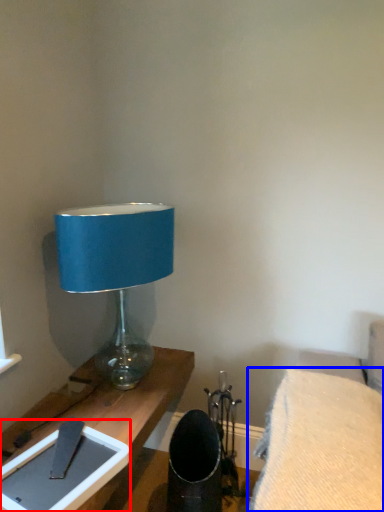
Question: Which object is closer to the camera taking this photo, tablet computer (highlighted by a red box) or furniture (highlighted by a blue box)?

Choices:
 (A) tablet computer
 (B) furniture

Answer: (B)